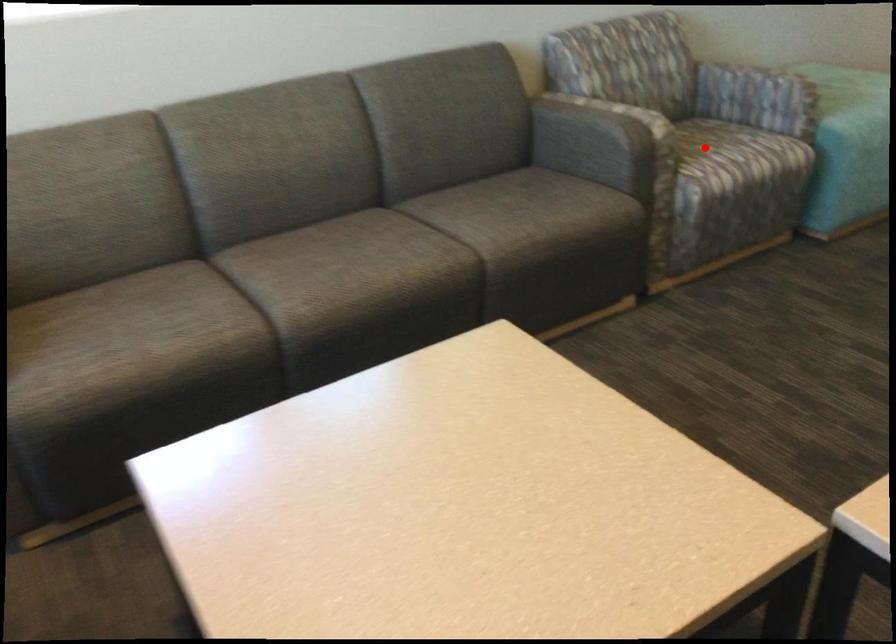
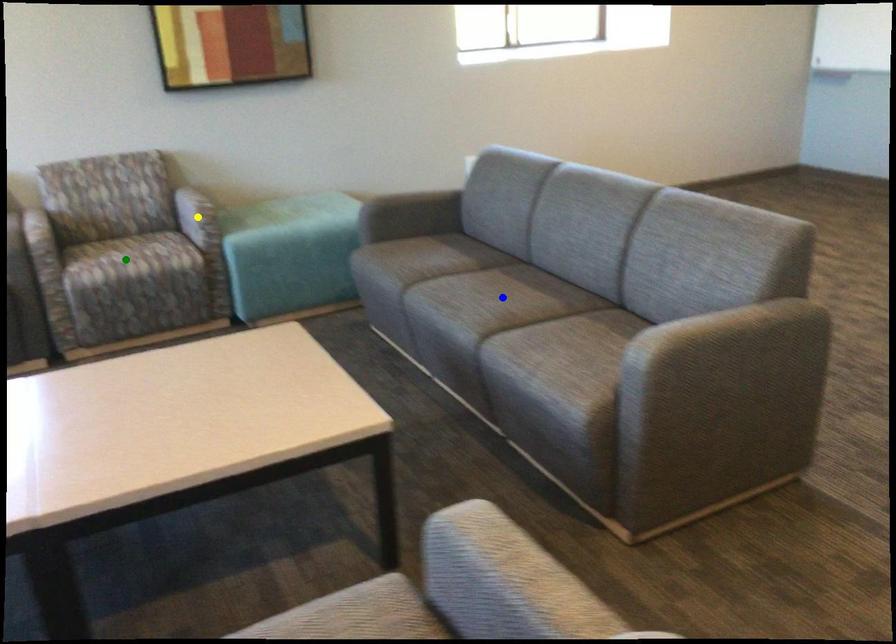
Question: I am providing you with two images of the same scene from different viewpoints. A red point is marked on the first image. You are given multiple points on the second image. Which spot in image 2 lines up with the point in image 1?

Choices:
 (A) yellow point
 (B) green point
 (C) blue point

Answer: (B)